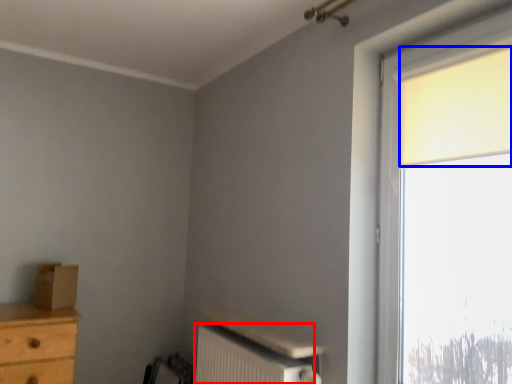
Question: Which of the following is the farthest to the observer, radiator (highlighted by a red box) or curtain (highlighted by a blue box)?

Choices:
 (A) radiator
 (B) curtain

Answer: (A)